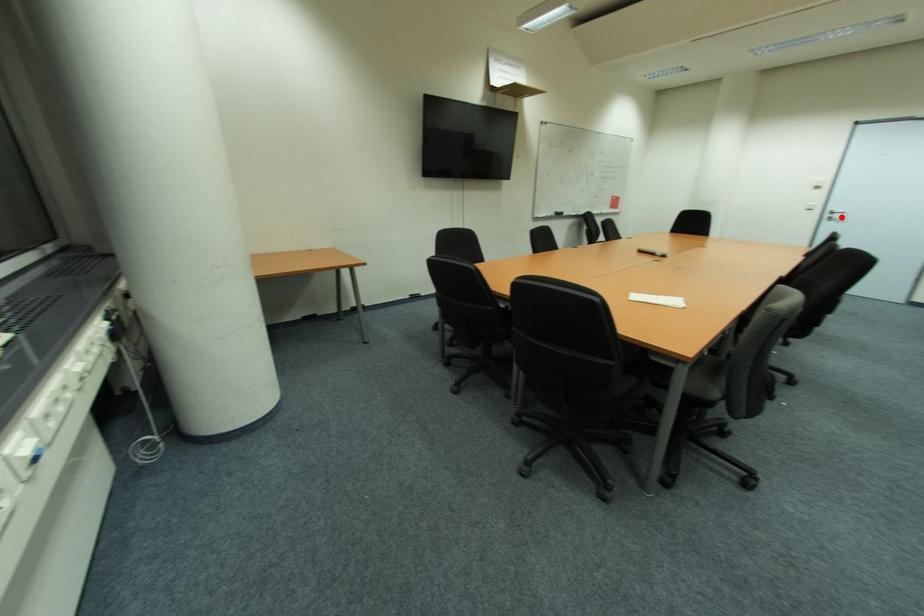
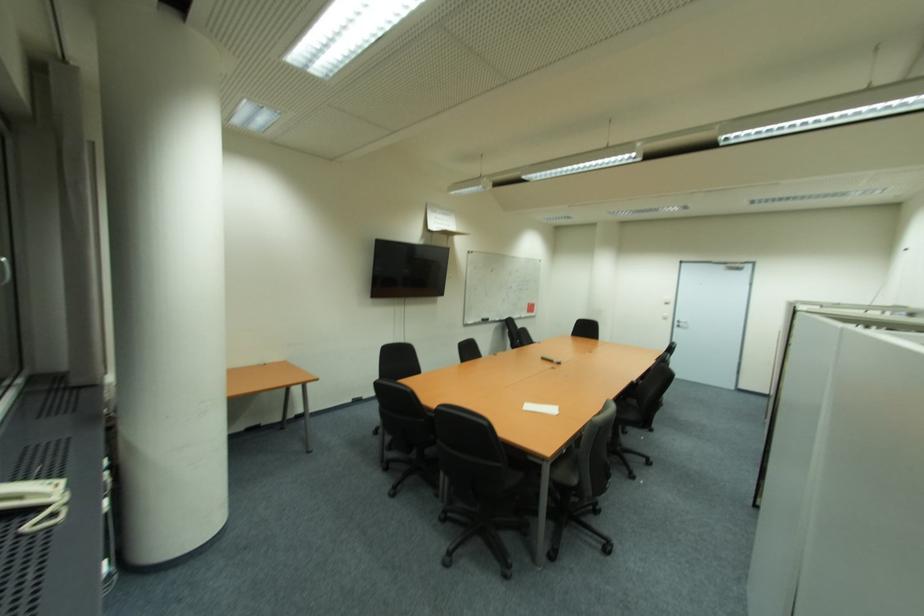
Question: I am providing you with two images of the same scene from different viewpoints. A red point is shown in image1. For the corresponding object point in image2, is it positioned nearer or farther from the camera?

Choices:
 (A) Nearer
 (B) Farther

Answer: (A)